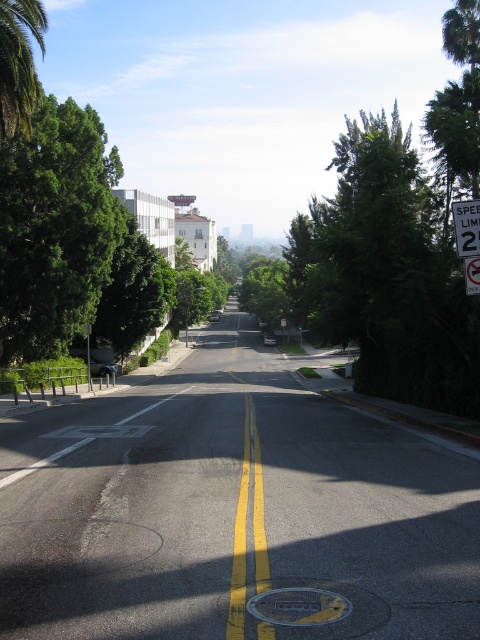
Question: Does green leafy palm tree at upper left have a larger size compared to metal speed limit sign at right?

Choices:
 (A) no
 (B) yes

Answer: (B)

Question: Which object is closer to the camera taking this photo?

Choices:
 (A) green leafy tree at left
 (B) white plastic speed limit sign at upper right
 (C) green leafy palm tree at upper left

Answer: (B)

Question: Where is metal speed limit sign at right located in relation to white plastic speed limit sign at upper right in the image?

Choices:
 (A) right
 (B) left

Answer: (B)

Question: Considering the real-world distances, which object is farthest from the metal speed limit sign at right?

Choices:
 (A) green leafy tree at left
 (B) green leafy palm tree at upper left
 (C) white plastic speed limit sign at upper right

Answer: (A)

Question: Which point is closer to the camera?

Choices:
 (A) metal speed limit sign at right
 (B) green leafy palm tree at upper left

Answer: (A)

Question: Does green leafy tree at left appear on the right side of white plastic speed limit sign at upper right?

Choices:
 (A) no
 (B) yes

Answer: (A)